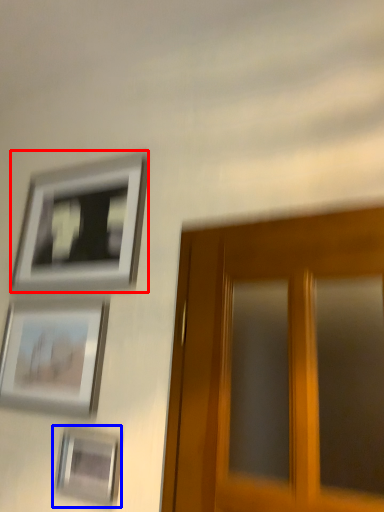
Question: Which object is further to the camera taking this photo, picture frame (highlighted by a red box) or picture frame (highlighted by a blue box)?

Choices:
 (A) picture frame
 (B) picture frame

Answer: (A)